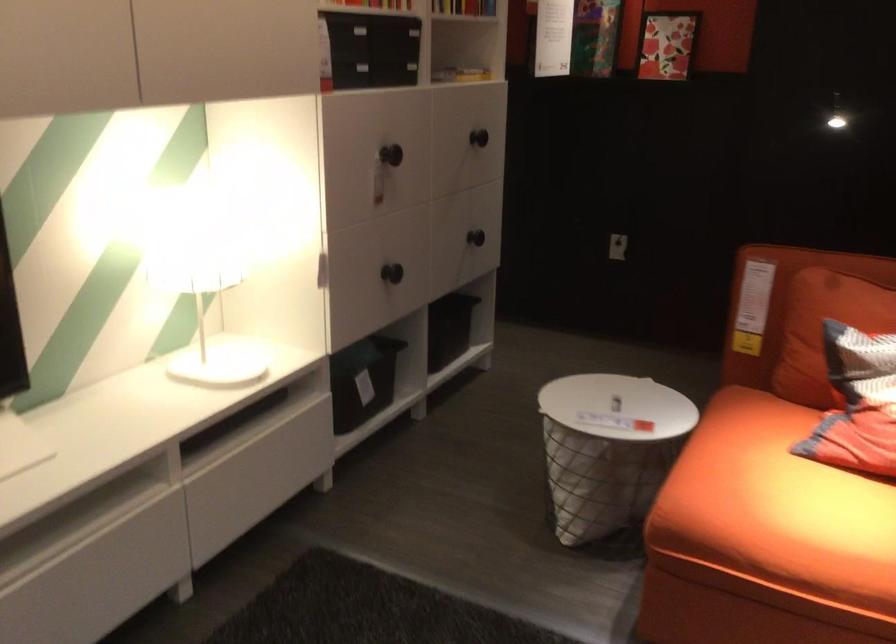
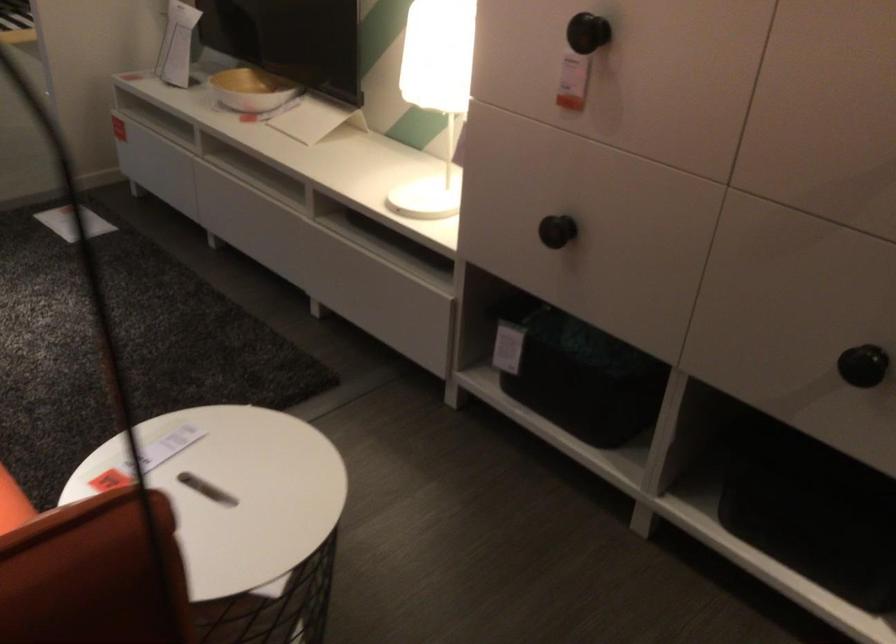
Locate, in the second image, the point that corresponds to (410,143) in the first image.

(588, 33)